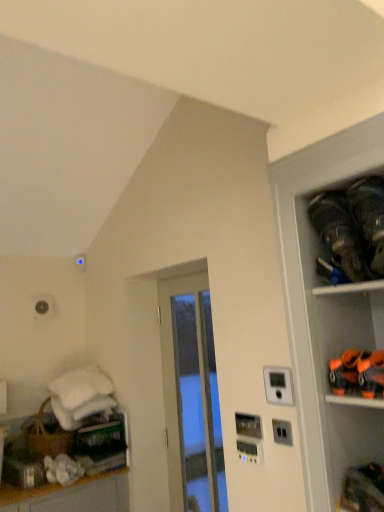
Question: Can you confirm if transparent glass door at center is smaller than black fabric shoes at upper right?

Choices:
 (A) yes
 (B) no

Answer: (B)

Question: Can black fabric shoes at upper right be found inside transparent glass door at center?

Choices:
 (A) no
 (B) yes

Answer: (A)

Question: Is transparent glass door at center taller than black fabric shoes at upper right?

Choices:
 (A) no
 (B) yes

Answer: (B)

Question: Does transparent glass door at center appear on the right side of black fabric shoes at upper right?

Choices:
 (A) no
 (B) yes

Answer: (A)

Question: Considering the relative sizes of transparent glass door at center and black fabric shoes at upper right in the image provided, is transparent glass door at center bigger than black fabric shoes at upper right?

Choices:
 (A) yes
 (B) no

Answer: (A)

Question: Is transparent glass door at center looking in the opposite direction of black fabric shoes at upper right?

Choices:
 (A) yes
 (B) no

Answer: (B)

Question: Can you confirm if black fabric shoes at upper right is wider than transparent glass door at center?

Choices:
 (A) no
 (B) yes

Answer: (B)

Question: From a real-world perspective, does black fabric shoes at upper right stand above transparent glass door at center?

Choices:
 (A) yes
 (B) no

Answer: (A)

Question: From the image's perspective, is black fabric shoes at upper right located beneath transparent glass door at center?

Choices:
 (A) no
 (B) yes

Answer: (A)

Question: Can you confirm if black fabric shoes at upper right is smaller than transparent glass door at center?

Choices:
 (A) yes
 (B) no

Answer: (A)

Question: Is the surface of black fabric shoes at upper right in direct contact with transparent glass door at center?

Choices:
 (A) no
 (B) yes

Answer: (A)

Question: Is black fabric shoes at upper right positioned far away from transparent glass door at center?

Choices:
 (A) no
 (B) yes

Answer: (B)

Question: Considering their positions, is black fabric shoes at upper right located in front of or behind transparent glass door at center?

Choices:
 (A) behind
 (B) front

Answer: (B)